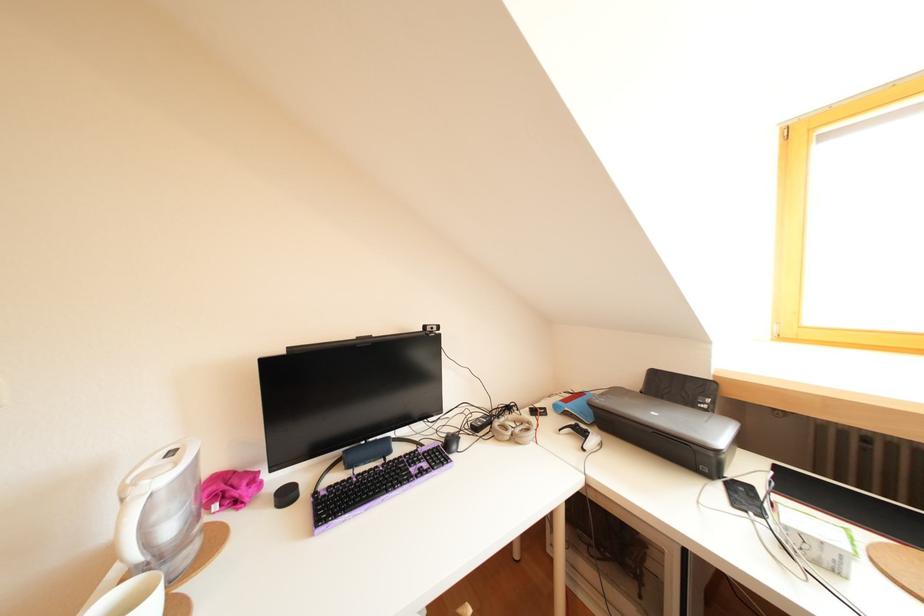
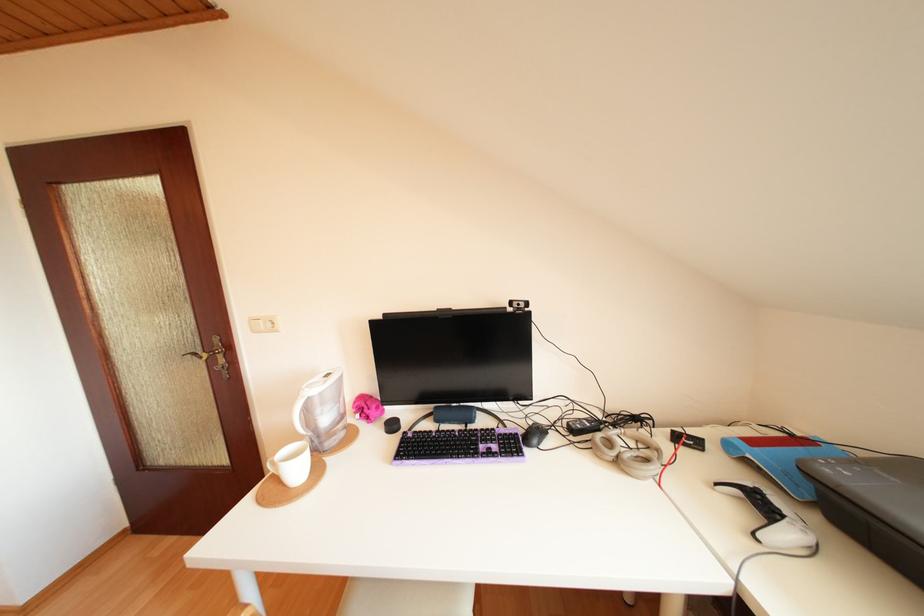
Question: The camera is either moving clockwise (left) or counter-clockwise (right) around the object. The first image is from the beginning of the video and the second image is from the end. Is the camera moving left or right when shooting the video?

Choices:
 (A) Left
 (B) Right

Answer: (B)